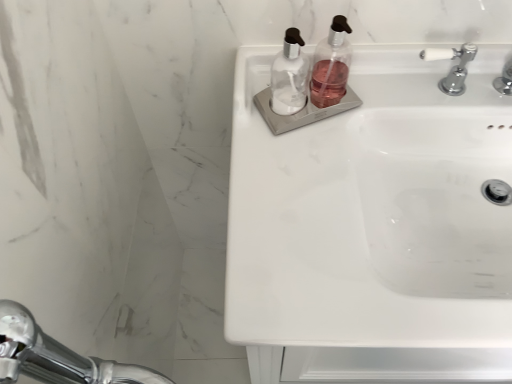
Question: Can you confirm if white ceramic tap at upper right is taller than transparent plastic soap dispenser at center, the second soap dispenser positioned from the right?

Choices:
 (A) yes
 (B) no

Answer: (B)

Question: Is white ceramic tap at upper right positioned far away from transparent plastic soap dispenser at center, the second soap dispenser positioned from the right?

Choices:
 (A) no
 (B) yes

Answer: (A)

Question: Is white ceramic tap at upper right positioned with its back to transparent plastic soap dispenser at center, the second soap dispenser positioned from the right?

Choices:
 (A) yes
 (B) no

Answer: (B)

Question: From the image's perspective, is white ceramic tap at upper right located above transparent plastic soap dispenser at center, which is the 1th soap dispenser from left to right?

Choices:
 (A) no
 (B) yes

Answer: (B)

Question: From the image's perspective, does white ceramic tap at upper right appear lower than transparent plastic soap dispenser at center, the second soap dispenser positioned from the right?

Choices:
 (A) yes
 (B) no

Answer: (B)

Question: Visually, is transparent plastic soap dispenser at center, which is the 1th soap dispenser from left to right, positioned to the left or to the right of white glossy sink at upper right?

Choices:
 (A) right
 (B) left

Answer: (B)

Question: From a real-world perspective, is transparent plastic soap dispenser at center, which is the 1th soap dispenser from left to right, physically located above or below white glossy sink at upper right?

Choices:
 (A) below
 (B) above

Answer: (B)

Question: Is transparent plastic soap dispenser at center, which is the 1th soap dispenser from left to right, in front of or behind white glossy sink at upper right in the image?

Choices:
 (A) front
 (B) behind

Answer: (B)

Question: Which is correct: transparent plastic soap dispenser at center, the second soap dispenser positioned from the right, is inside white glossy sink at upper right, or outside of it?

Choices:
 (A) outside
 (B) inside

Answer: (A)

Question: Would you say transparent plastic soap dispenser at upper center, marked as the 1th soap dispenser in a right-to-left arrangement, is inside or outside white ceramic tap at upper right?

Choices:
 (A) outside
 (B) inside

Answer: (A)

Question: Considering the relative positions of transparent plastic soap dispenser at upper center, marked as the 1th soap dispenser in a right-to-left arrangement, and white ceramic tap at upper right in the image provided, is transparent plastic soap dispenser at upper center, marked as the 1th soap dispenser in a right-to-left arrangement, to the left or to the right of white ceramic tap at upper right?

Choices:
 (A) right
 (B) left

Answer: (B)

Question: Is transparent plastic soap dispenser at upper center, marked as the 1th soap dispenser in a right-to-left arrangement, in front of or behind white ceramic tap at upper right in the image?

Choices:
 (A) behind
 (B) front

Answer: (B)

Question: Looking at the image, does transparent plastic soap dispenser at upper center, which ranks as the second soap dispenser in left-to-right order, seem bigger or smaller compared to white ceramic tap at upper right?

Choices:
 (A) small
 (B) big

Answer: (A)

Question: Is point (441, 79) closer or farther from the camera than point (366, 86)?

Choices:
 (A) farther
 (B) closer

Answer: (A)

Question: Based on their sizes in the image, would you say white ceramic tap at upper right is bigger or smaller than white glossy sink at upper right?

Choices:
 (A) small
 (B) big

Answer: (A)